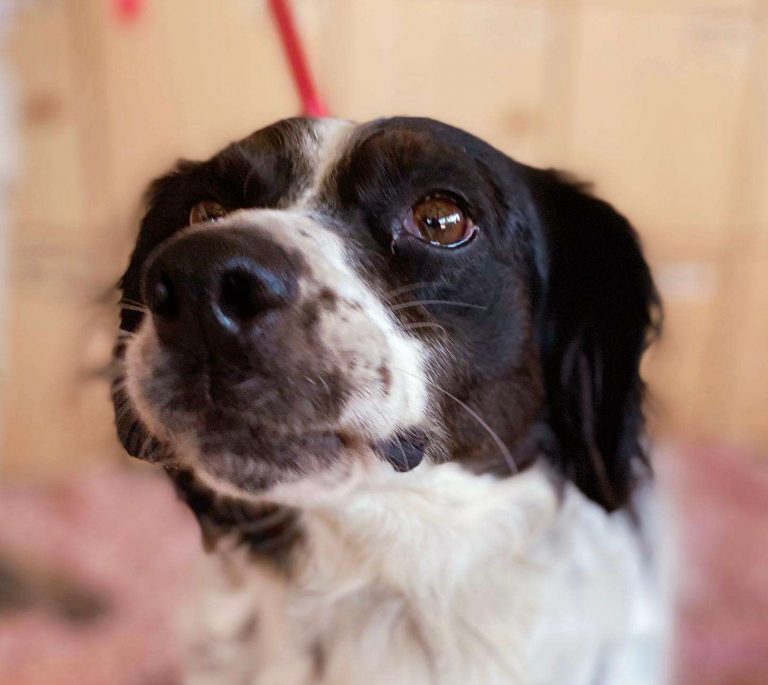
You are a GUI agent. You are given a task and a screenshot of the screen. Output one action in this format:
    pyautogui.click(x=<x>, y=<y>)
    Task: Click on the white fur
    The height and width of the screenshot is (685, 768).
    Given the screenshot: What is the action you would take?
    pyautogui.click(x=452, y=532), pyautogui.click(x=355, y=573), pyautogui.click(x=359, y=497)